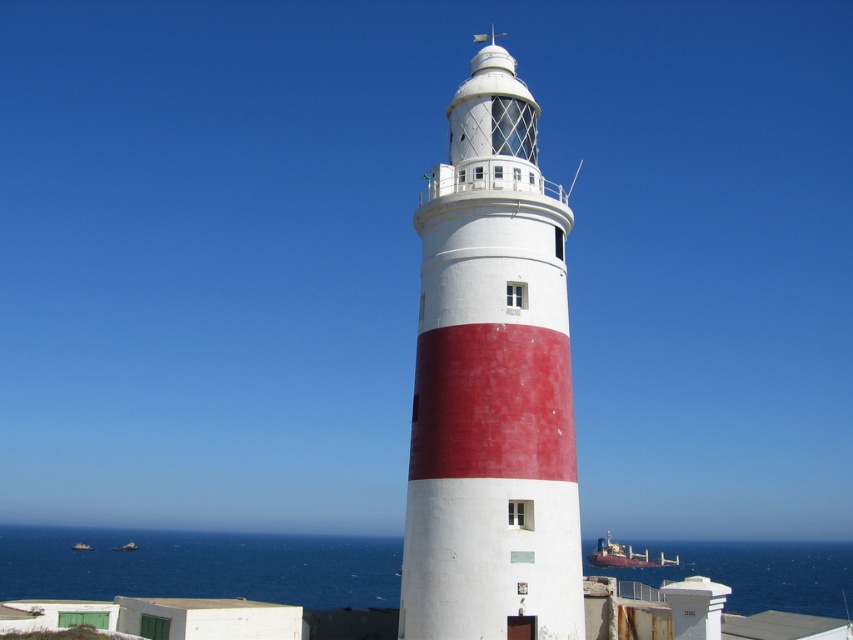
Question: Which point is farther from the camera taking this photo?

Choices:
 (A) (x=660, y=556)
 (B) (x=93, y=548)
 (C) (x=680, y=566)

Answer: (B)

Question: Can you confirm if metallic gray ship at lower center is positioned above metallic gray ship at lower left?

Choices:
 (A) yes
 (B) no

Answer: (A)

Question: Among these points, which one is farthest from the camera?

Choices:
 (A) (271, 538)
 (B) (486, 428)

Answer: (A)

Question: Is white painted lighthouse at center positioned at the back of blue water at lower center?

Choices:
 (A) yes
 (B) no

Answer: (B)

Question: Does metallic gray boat at lower left appear under metallic gray ship at lower left?

Choices:
 (A) yes
 (B) no

Answer: (B)

Question: Which object appears farthest from the camera in this image?

Choices:
 (A) metallic gray ship at lower center
 (B) metallic gray ship at lower left

Answer: (B)